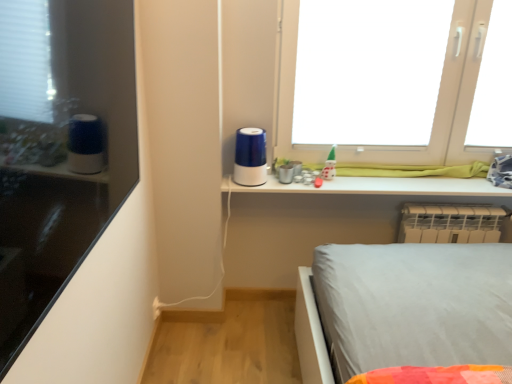
What are the coordinates of `vacant area located to the right-hand side of green glossy toy at upper center` in the screenshot? It's located at (359, 180).